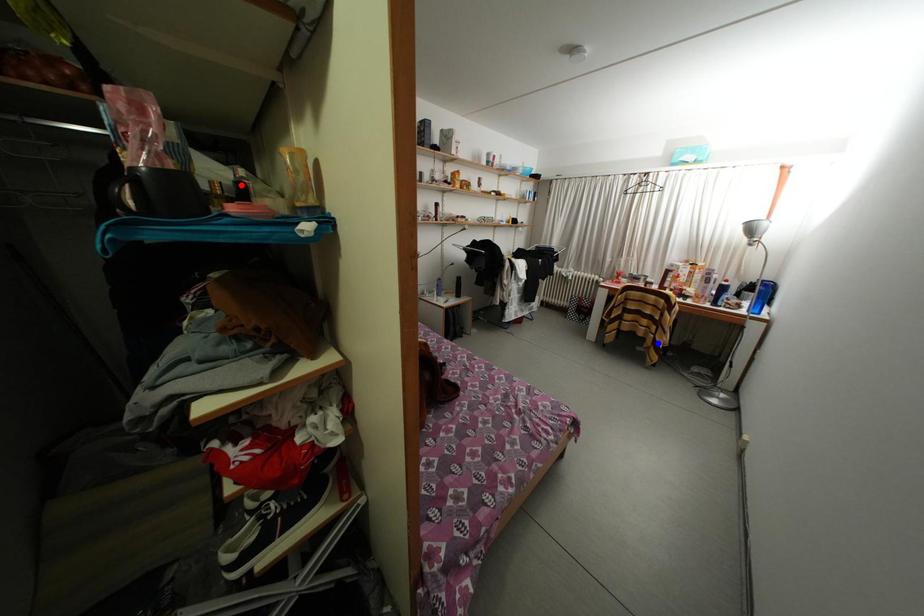
Question: Two points are marked on the image. Which point is closer to the camera?

Choices:
 (A) Blue point is closer.
 (B) Red point is closer.

Answer: (B)